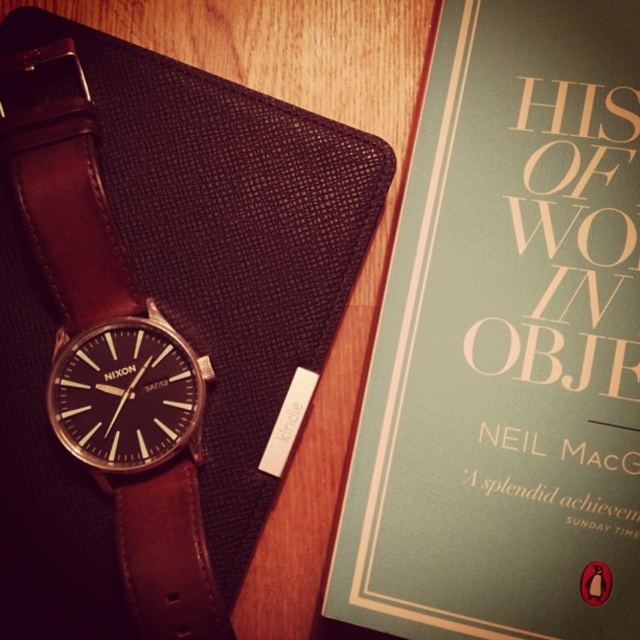
Is teal matte book at upper right further to camera compared to brown leather strap at left?

That is False.

Where is `teal matte book at upper right`? teal matte book at upper right is located at coordinates (508, 342).

Who is more distant from viewer, (508, 257) or (54, 108)?

The point (54, 108) is behind.

This screenshot has height=640, width=640. In order to click on teal matte book at upper right in this screenshot , I will do `click(508, 342)`.